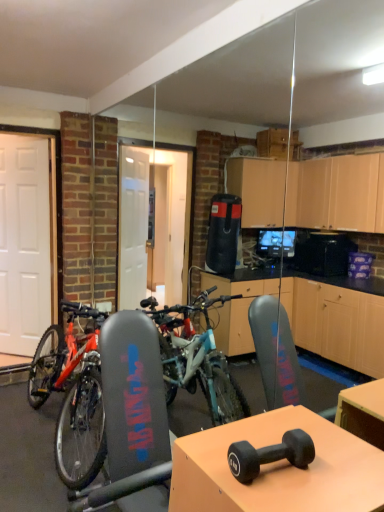
Question: Can you confirm if white matte door at left is bigger than matte black dumbbell at center?

Choices:
 (A) no
 (B) yes

Answer: (B)

Question: Considering the relative sizes of white matte door at left and matte black dumbbell at center in the image provided, is white matte door at left smaller than matte black dumbbell at center?

Choices:
 (A) yes
 (B) no

Answer: (B)

Question: Is white matte door at left to the right of matte black dumbbell at center from the viewer's perspective?

Choices:
 (A) yes
 (B) no

Answer: (B)

Question: Is matte black dumbbell at center located within white matte door at left?

Choices:
 (A) no
 (B) yes

Answer: (A)

Question: Can you confirm if white matte door at left is taller than matte black dumbbell at center?

Choices:
 (A) no
 (B) yes

Answer: (B)

Question: Considering the relative sizes of white matte door at left and matte black dumbbell at center in the image provided, is white matte door at left wider than matte black dumbbell at center?

Choices:
 (A) yes
 (B) no

Answer: (B)

Question: Is white matte door at left positioned beyond the bounds of black rubber dumbbell at center?

Choices:
 (A) yes
 (B) no

Answer: (A)

Question: From a real-world perspective, is white matte door at left physically below black rubber dumbbell at center?

Choices:
 (A) yes
 (B) no

Answer: (B)

Question: From the image's perspective, is white matte door at left on black rubber dumbbell at center?

Choices:
 (A) no
 (B) yes

Answer: (B)

Question: Is white matte door at left positioned far away from black rubber dumbbell at center?

Choices:
 (A) no
 (B) yes

Answer: (B)

Question: Can you confirm if white matte door at left is bigger than black rubber dumbbell at center?

Choices:
 (A) yes
 (B) no

Answer: (A)

Question: Is white matte door at left thinner than black rubber dumbbell at center?

Choices:
 (A) no
 (B) yes

Answer: (B)

Question: Is matte black dumbbell at center taller than black rubber dumbbell at center?

Choices:
 (A) no
 (B) yes

Answer: (B)